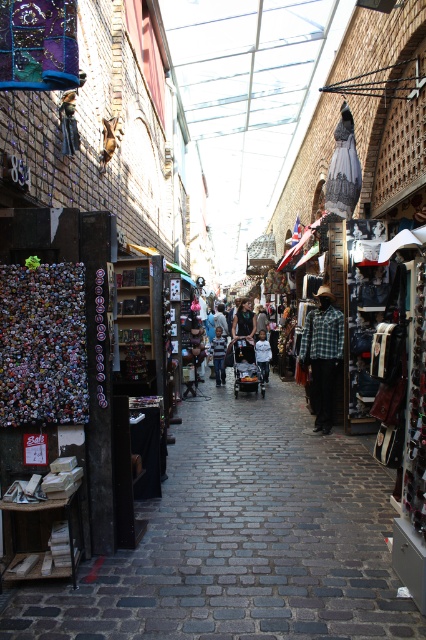
You are a delivery person carrying a box that is 1.2 meters long. You need to walk through the narrow cobblestone street shown in the image. There are two objects in your path at the center of the street, the smooth wooden shelves at center and the flannel shirt at center. Can you pass through the space between them with your box without tilting it?

The smooth wooden shelves at center is 3.87 meters away from the flannel shirt at center. Since the box is only 1.2 meters long, there is sufficient space between the two objects to pass through without tilting the box.

You are a customer in the market and want to reach the flannel shirt at center. Can you easily access it without moving the smooth wooden shelves at center?

The smooth wooden shelves at center is shorter than flannel shirt at center, so the flannel shirt at center is taller and may be easier to reach without needing to move the shelves.

You are a customer in the market and want to find the smooth wooden shelves at center. According to the scene description, where should you look?

You should look at point (x=241, y=540) to find the smooth wooden shelves at center.